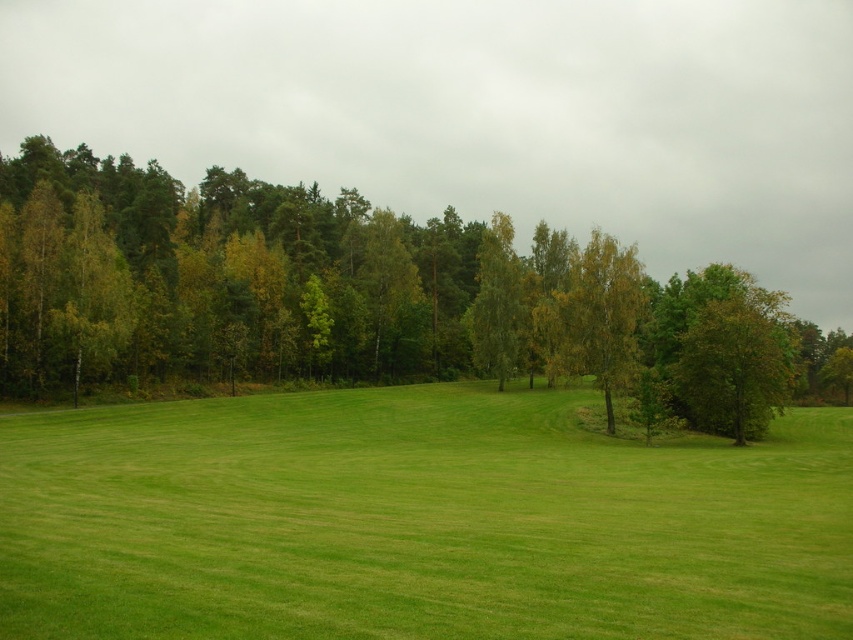
You are planning to set up a picnic blanket in the park. The picnic blanket is 2 meters wide. You see the green grass at center and the green leafy tree at right. Which area would be suitable for placing the blanket without overlapping any obstacles?

The green grass at center has a larger width than the green leafy tree at right, so placing the picnic blanket on the green grass at center would be suitable as it provides enough space without overlapping obstacles.

You are standing at the point labeled as point (416, 522) in the image. Based on the scene description, what type of terrain are you currently standing on?

The point (416, 522) corresponds to green grass at center, so you are standing on green grass.

You are planning to set up a picnic blanket in the park. The green grass at center and the green leafy tree at right are both visible from where you stand. Which area would provide more space for your blanket, and why?

The green grass at center would provide more space for your picnic blanket because it is larger in size than the green leafy tree at right.